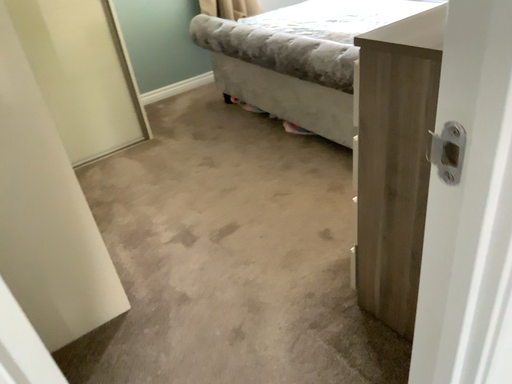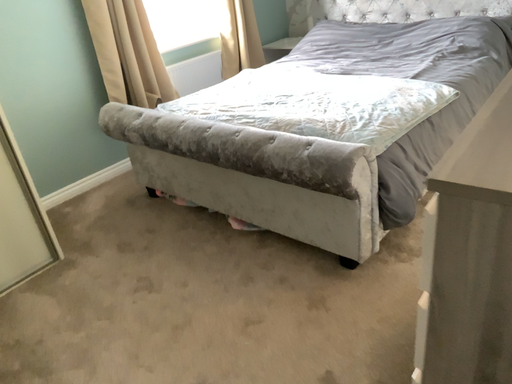
Question: Which way did the camera rotate in the video?

Choices:
 (A) rotated upward
 (B) rotated downward

Answer: (A)